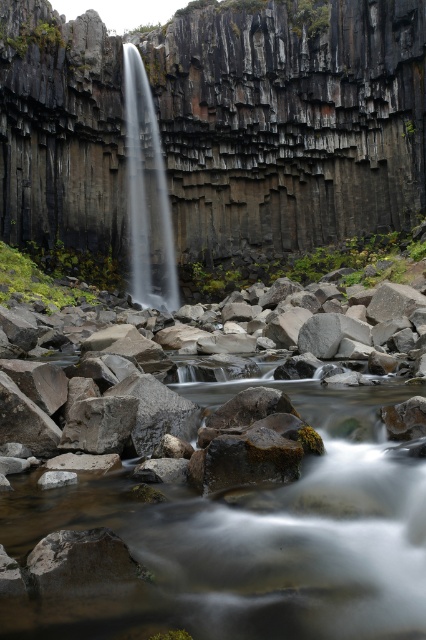
Can you confirm if smooth rock stream at center is wider than clear water at center?

In fact, smooth rock stream at center might be narrower than clear water at center.

Is smooth rock stream at center positioned before clear water at center?

Yes.

This screenshot has height=640, width=426. I want to click on smooth rock stream at center, so click(x=250, y=540).

Identify the location of smooth rock stream at center. (250, 540).

In the scene shown: Between dark gray basalt cliff at center and clear water at center, which one appears on the left side from the viewer's perspective?

Positioned to the left is clear water at center.

Between point (81, 20) and point (134, 140), which one is positioned behind?

The point (134, 140) is behind.

Is point (304, 20) closer to camera compared to point (129, 220)?

Yes.

Where is `dark gray basalt cliff at center`? The height and width of the screenshot is (640, 426). dark gray basalt cliff at center is located at coordinates (290, 122).

Is point (81, 93) more distant than point (334, 454)?

Yes, point (81, 93) is behind point (334, 454).

Can you confirm if dark gray basalt cliff at center is bigger than smooth rock stream at center?

Yes.

Does point (250, 81) come in front of point (294, 609)?

No, it is behind (294, 609).

At what (x,y) coordinates should I click in order to perform the action: click on dark gray basalt cliff at center. Please return your answer as a coordinate pair (x, y). This screenshot has height=640, width=426. Looking at the image, I should click on (290, 122).